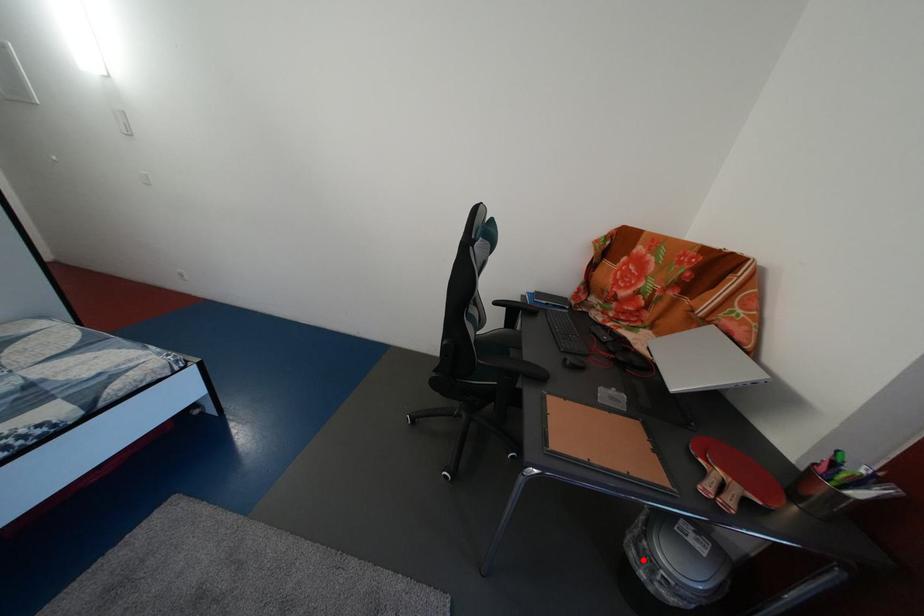
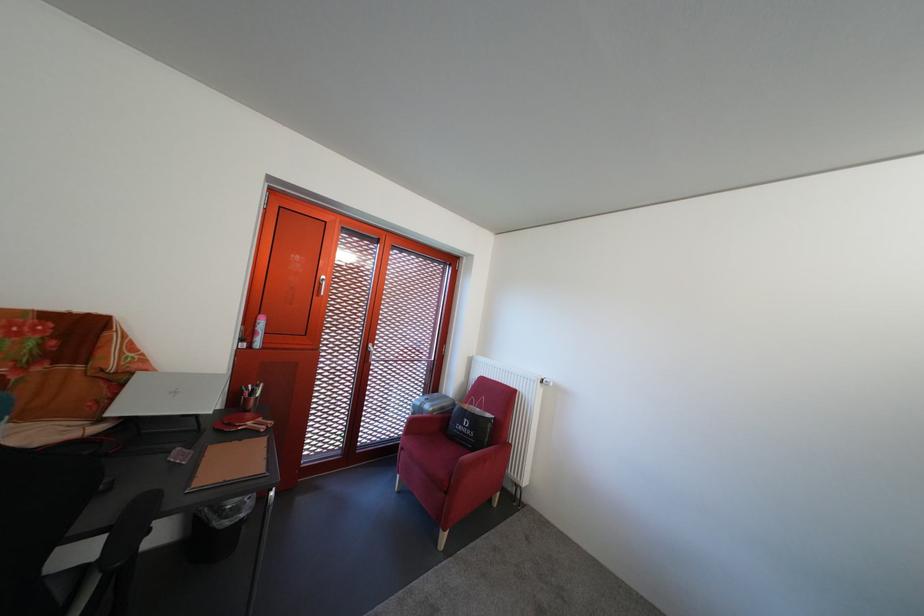
Question: I am providing you with two images of the same scene from different viewpoints. Given a red point in image1, look at the same physical point in image2. Is it:

Choices:
 (A) Closer to the viewpoint
 (B) Farther from the viewpoint

Answer: (A)